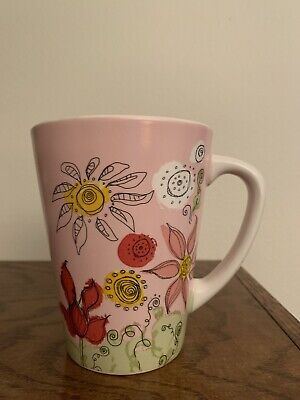
Where is `wooden table top`? This screenshot has width=300, height=400. wooden table top is located at coordinates (226, 338).